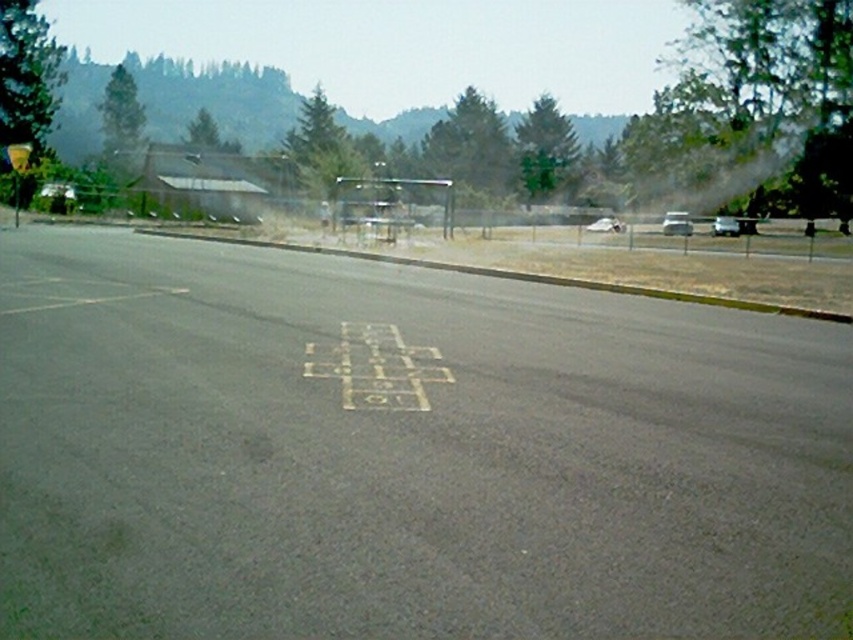
You are a delivery driver who needs to park your white matte car at center in the parking lot. There is a yellow plastic sign at upper left that you must not hit. Can you safely park your car without hitting the sign?

The yellow plastic sign at upper left might be wider than white matte car at center, so there is a possibility that the sign is wider than the car. However, without exact measurements, it is uncertain. You should proceed with caution and ensure there is enough space to park safely without hitting the sign.

You are standing at the point marked by point (676, 224) in the image. What object is directly in front of you?

The silver metallic car at center is directly in front of you at point (676, 224).

From the picture: You are standing at the center of the paved area and see two points marked on the pavement. The first point is at coordinate point [674,220] and the second is at point [45,188]. If you want to walk towards the point that is closer to you, which coordinate should you head towards?

You should head towards point [45,188] because it is closer to you than point [674,220], which is further away.